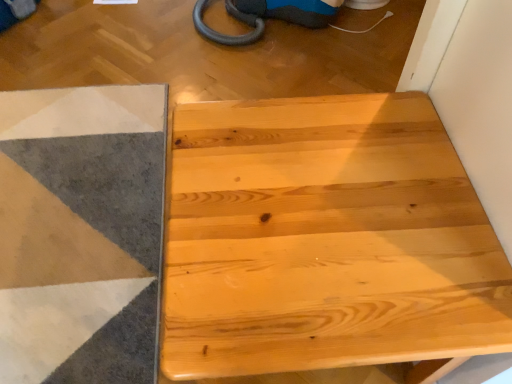
Where is `blank space situated above natural wood table at center (from a real-world perspective)`? The height and width of the screenshot is (384, 512). blank space situated above natural wood table at center (from a real-world perspective) is located at coordinates (320, 201).